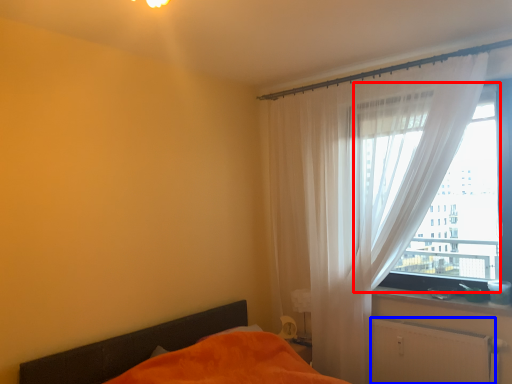
Question: Which object appears closest to the camera in this image, window (highlighted by a red box) or radiator (highlighted by a blue box)?

Choices:
 (A) window
 (B) radiator

Answer: (B)